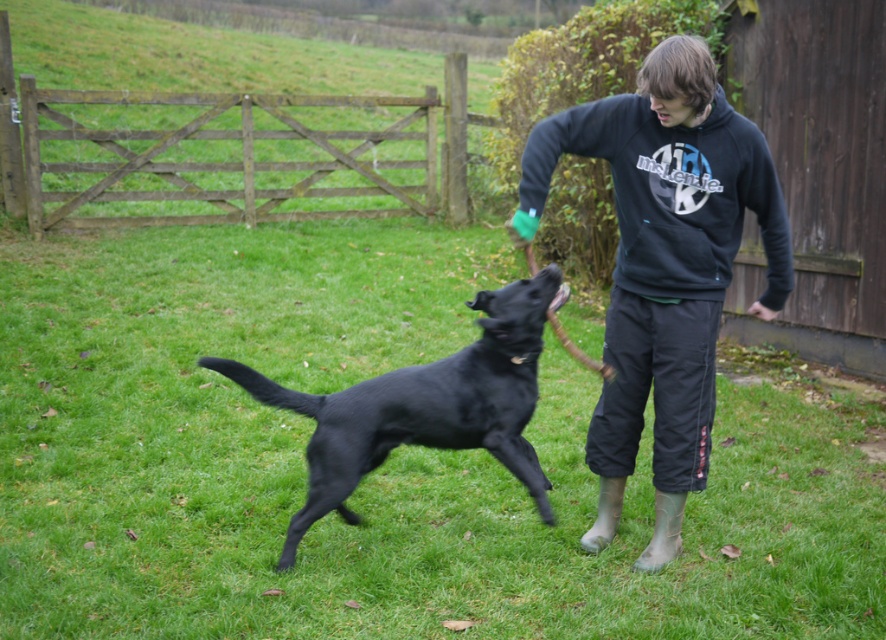
How much distance is there between green grass at center and matte black sweatshirt at upper right?

2.35 meters

Which is more to the right, green grass at center or matte black sweatshirt at upper right?

matte black sweatshirt at upper right

Is point (828, 586) behind point (690, 291)?

No, it is in front of (690, 291).

Where is `green grass at center`? green grass at center is located at coordinates (379, 467).

The image size is (886, 640). In order to click on matte black sweatshirt at upper right in this screenshot , I will do `click(667, 193)`.

Does point (535, 131) lie behind point (519, 380)?

No, it is not.

Locate an element on the screen. matte black sweatshirt at upper right is located at coordinates (667, 193).

Who is higher up, green grass at center or shiny black dog at center?

green grass at center

Between green grass at center and shiny black dog at center, which one appears on the left side from the viewer's perspective?

Positioned to the left is green grass at center.

Who is more forward, (377, 602) or (377, 403)?

Point (377, 602) is more forward.

The width and height of the screenshot is (886, 640). Find the location of `green grass at center`. green grass at center is located at coordinates (379, 467).